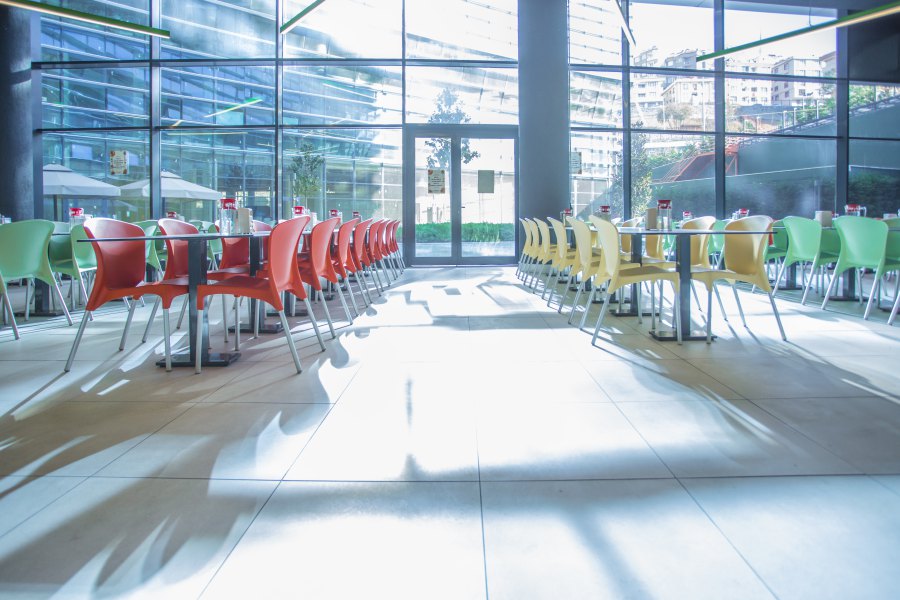
Where is `red chairs`? red chairs is located at coordinates (120, 263), (174, 255), (236, 252), (289, 276), (319, 263), (344, 255), (360, 253), (380, 249), (388, 245).